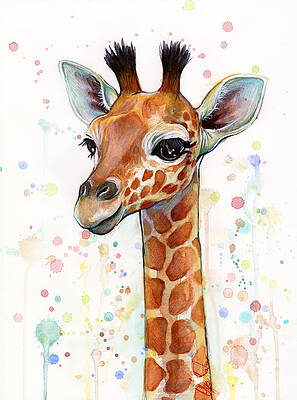
Locate an element on the screen. The height and width of the screenshot is (400, 297). paint is located at coordinates (117, 292).